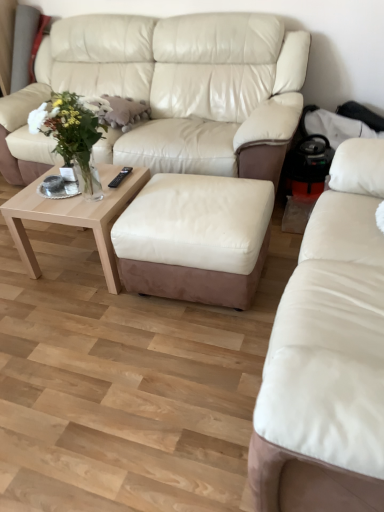
Where is `free space in front of light wood/texture coffee table at lower center`? This screenshot has width=384, height=512. free space in front of light wood/texture coffee table at lower center is located at coordinates (84, 317).